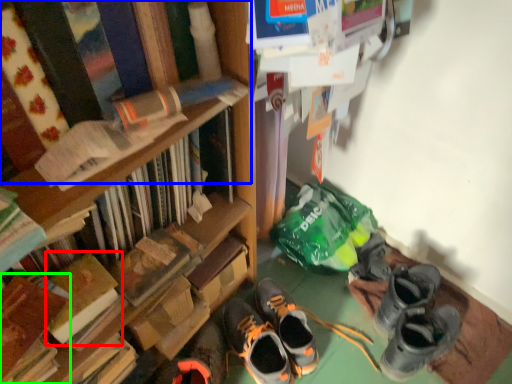
Question: Which object is positioned farthest from book (highlighted by a red box)? Select from book (highlighted by a blue box) and book (highlighted by a green box).

Choices:
 (A) book
 (B) book

Answer: (A)